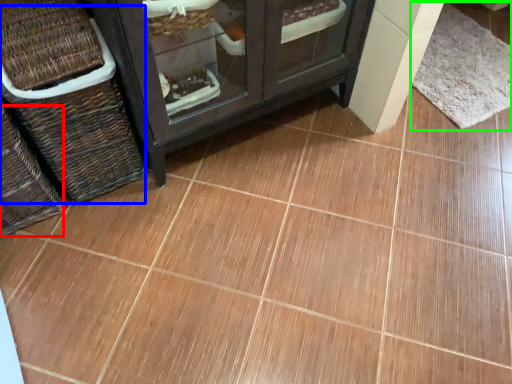
Question: Estimate the real-world distances between objects in this image. Which object is farther from basket (highlighted by a red box), basket (highlighted by a blue box) or mat (highlighted by a green box)?

Choices:
 (A) basket
 (B) mat

Answer: (B)